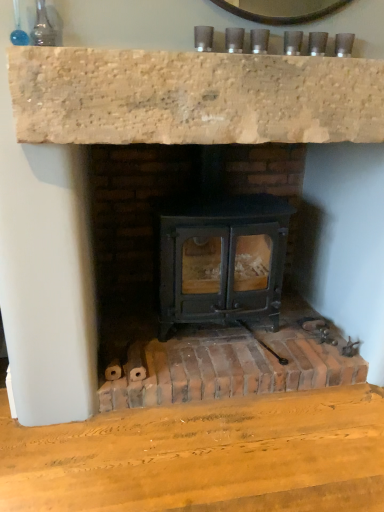
Describe the element at coordinates (229, 366) in the screenshot. I see `brick hearth at center` at that location.

What is the approximate height of brick hearth at center?

brick hearth at center is 4.94 inches in height.

Locate an element on the screen. brick hearth at center is located at coordinates click(229, 366).

Locate an element on the screen. brick hearth at center is located at coordinates (229, 366).